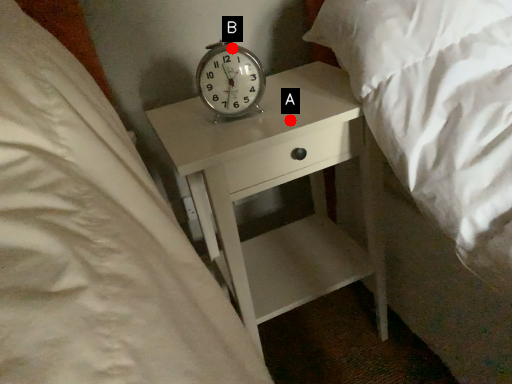
Question: Two points are circled on the image, labeled by A and B beside each circle. Which point is closer to the camera taking this photo?

Choices:
 (A) A is closer
 (B) B is closer

Answer: (A)